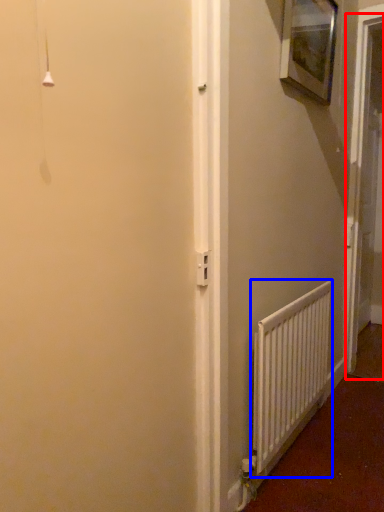
Question: Which point is closer to the camera, screen door (highlighted by a red box) or radiator (highlighted by a blue box)?

Choices:
 (A) screen door
 (B) radiator

Answer: (B)